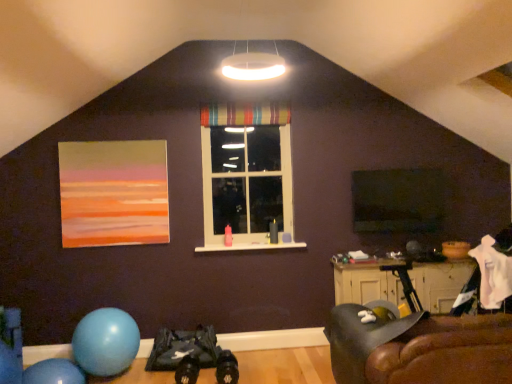
Question: From a real-world perspective, is striped fabric curtain at upper center over leather couch at lower right?

Choices:
 (A) no
 (B) yes

Answer: (B)

Question: Is striped fabric curtain at upper center with leather couch at lower right?

Choices:
 (A) no
 (B) yes

Answer: (A)

Question: Considering the relative positions of striped fabric curtain at upper center and leather couch at lower right in the image provided, is striped fabric curtain at upper center to the right of leather couch at lower right from the viewer's perspective?

Choices:
 (A) yes
 (B) no

Answer: (B)

Question: Does striped fabric curtain at upper center have a lesser height compared to leather couch at lower right?

Choices:
 (A) yes
 (B) no

Answer: (A)

Question: Does striped fabric curtain at upper center have a greater width compared to leather couch at lower right?

Choices:
 (A) no
 (B) yes

Answer: (A)

Question: Considering the positions of leather couch at lower right and striped fabric window at center in the image, is leather couch at lower right taller or shorter than striped fabric window at center?

Choices:
 (A) tall
 (B) short

Answer: (B)

Question: In the image, is leather couch at lower right on the left side or the right side of striped fabric window at center?

Choices:
 (A) left
 (B) right

Answer: (B)

Question: From a real-world perspective, relative to striped fabric window at center, is leather couch at lower right vertically above or below?

Choices:
 (A) above
 (B) below

Answer: (B)

Question: Based on their sizes in the image, would you say leather couch at lower right is bigger or smaller than striped fabric window at center?

Choices:
 (A) big
 (B) small

Answer: (A)

Question: From their relative heights in the image, would you say matte acrylic painting at upper left is taller or shorter than transparent plastic window screen at center?

Choices:
 (A) short
 (B) tall

Answer: (B)

Question: In the image, is matte acrylic painting at upper left on the left side or the right side of transparent plastic window screen at center?

Choices:
 (A) right
 (B) left

Answer: (B)

Question: Relative to transparent plastic window screen at center, is matte acrylic painting at upper left in front or behind?

Choices:
 (A) front
 (B) behind

Answer: (A)

Question: In terms of width, does matte acrylic painting at upper left look wider or thinner when compared to transparent plastic window screen at center?

Choices:
 (A) wide
 (B) thin

Answer: (B)

Question: Based on their positions, is striped fabric curtain at upper center located to the left or right of wooden cabinet at lower right?

Choices:
 (A) right
 (B) left

Answer: (B)

Question: Which is correct: striped fabric curtain at upper center is inside wooden cabinet at lower right, or outside of it?

Choices:
 (A) outside
 (B) inside

Answer: (A)